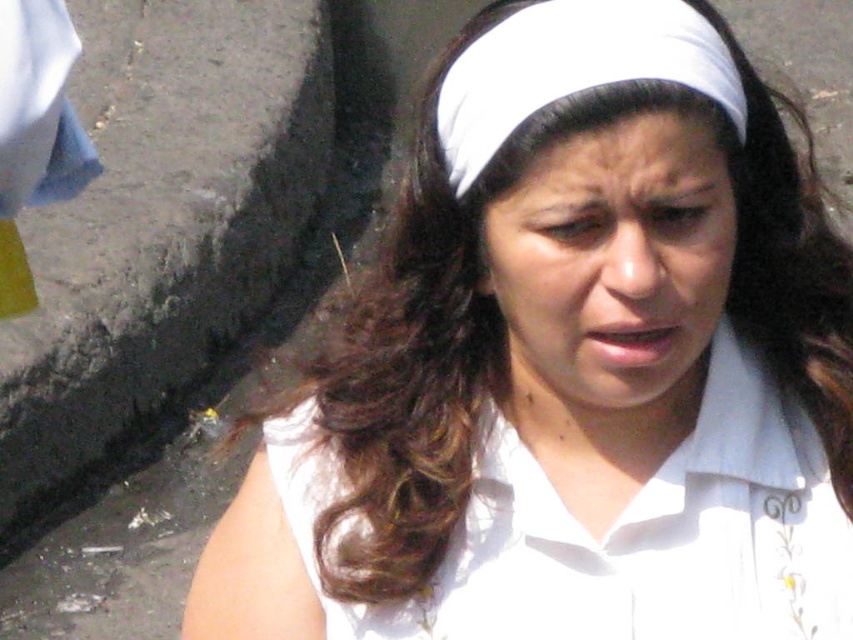
Question: Among these points, which one is farthest from the camera?

Choices:
 (A) (646, 109)
 (B) (724, 460)
 (C) (651, 337)
 (D) (704, 76)

Answer: (B)

Question: Estimate the real-world distances between objects in this image. Which object is farther from the asphalt at lower left?

Choices:
 (A) white fabric headscarf at center
 (B) white matte forehead at center
 (C) white cotton shirt at center
 (D) white matte headband at center

Answer: (B)

Question: Does asphalt at lower left have a greater width compared to white matte forehead at center?

Choices:
 (A) no
 (B) yes

Answer: (B)

Question: Among these points, which one is nearest to the camera?

Choices:
 (A) (593, 20)
 (B) (312, 67)
 (C) (564, 134)

Answer: (C)

Question: Does white cotton shirt at center appear under white matte headband at center?

Choices:
 (A) no
 (B) yes

Answer: (B)

Question: Does white matte headband at center have a smaller size compared to white fabric headscarf at center?

Choices:
 (A) no
 (B) yes

Answer: (A)